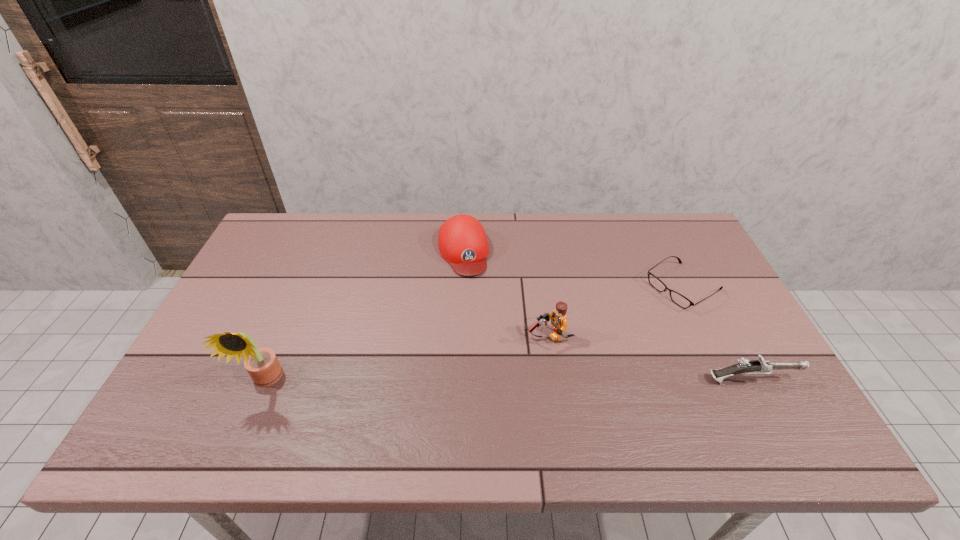
Identify the location of vacant area that lies between the baseball cap and the sunflower. This screenshot has width=960, height=540. (365, 316).

Find the location of a particular element. The width and height of the screenshot is (960, 540). object that is the second closest to the tallest object is located at coordinates (558, 317).

Select which object is the closest to the leftmost object. Please provide its 2D coordinates. Your answer should be formatted as a tuple, i.e. [(x, y)], where the tuple contains the x and y coordinates of a point satisfying the conditions above.

[(462, 241)]

Locate an element on the screen. This screenshot has width=960, height=540. vacant region that satisfies the following two spatial constraints: 1. on the front side of the shortest object; 2. aimed along the barrel of the fourth tallest object is located at coordinates (728, 380).